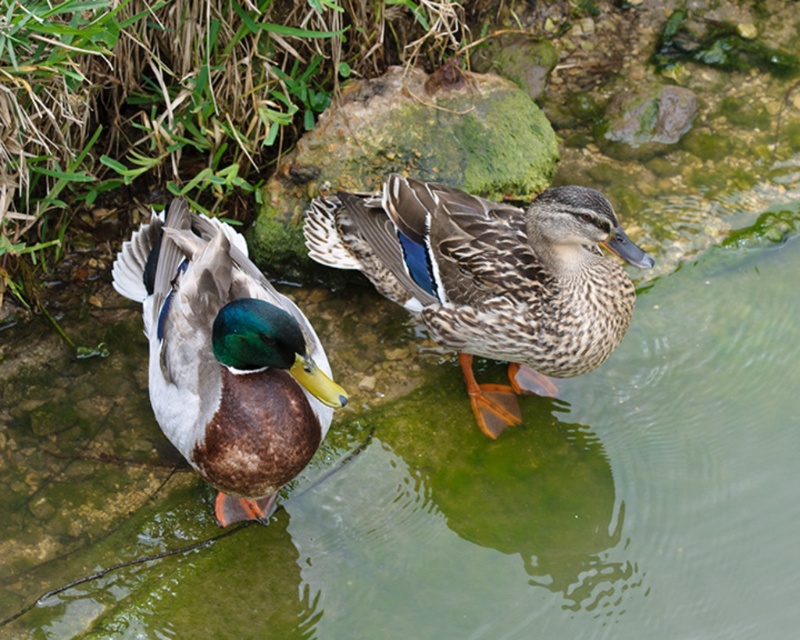
Question: Is speckled feathered duck at center positioned behind green mossy rock at center?

Choices:
 (A) no
 (B) yes

Answer: (A)

Question: Which point appears closest to the camera in this image?

Choices:
 (A) (526, 362)
 (B) (212, 433)

Answer: (B)

Question: Which point appears farthest from the camera in this image?

Choices:
 (A) (516, 336)
 (B) (126, 292)

Answer: (A)

Question: Is shiny brown duck at left bigger than green mossy rock at center?

Choices:
 (A) no
 (B) yes

Answer: (B)

Question: Which point is farther from the camera taking this photo?

Choices:
 (A) (428, 179)
 (B) (300, 468)
 (C) (530, 218)

Answer: (A)

Question: Does speckled feathered duck at center appear under shiny brown duck at left?

Choices:
 (A) no
 (B) yes

Answer: (A)